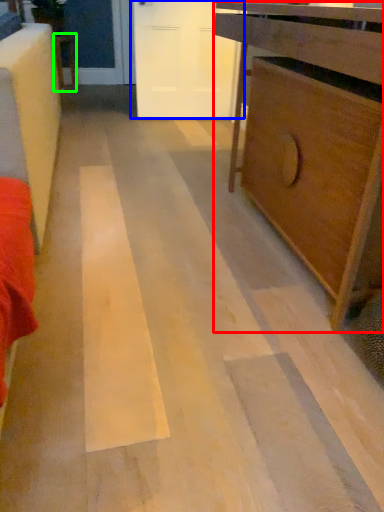
Question: Estimate the real-world distances between objects in this image. Which object is farther from chest of drawers (highlighted by a red box), door (highlighted by a blue box) or furniture (highlighted by a green box)?

Choices:
 (A) door
 (B) furniture

Answer: (B)